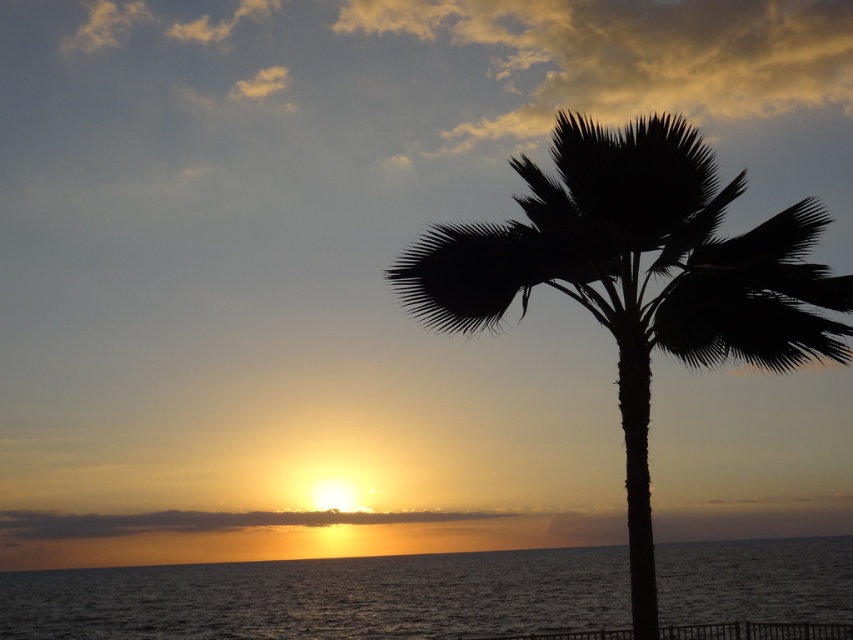
You are an artist trying to paint the sunset scene. You notice the black silhouette palm tree at center and the silvery water at lower center. Which object should you draw first if you want to follow the rule of drawing smaller objects before larger ones?

The black silhouette palm tree at center should be drawn first because it is smaller than the silvery water at lower center, following the rule of drawing smaller objects before larger ones.

You are standing on the beach and want to take a photo of the silvery water at lower center without the black silhouette palm tree at center blocking the view. Which direction should you move to ensure the palm tree is out of frame?

Move to the right side of the silvery water at lower center since the black silhouette palm tree at center is positioned on the left side of it.